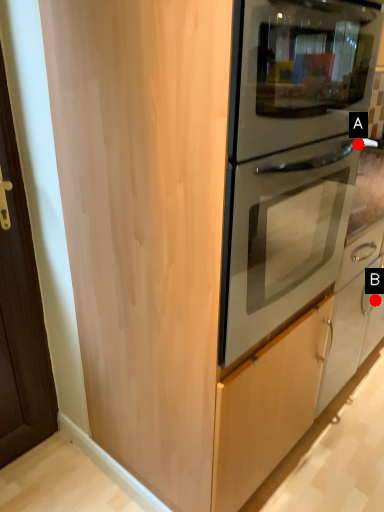
Question: Two points are circled on the image, labeled by A and B beside each circle. Which point is closer to the camera taking this photo?

Choices:
 (A) A is closer
 (B) B is closer

Answer: (A)